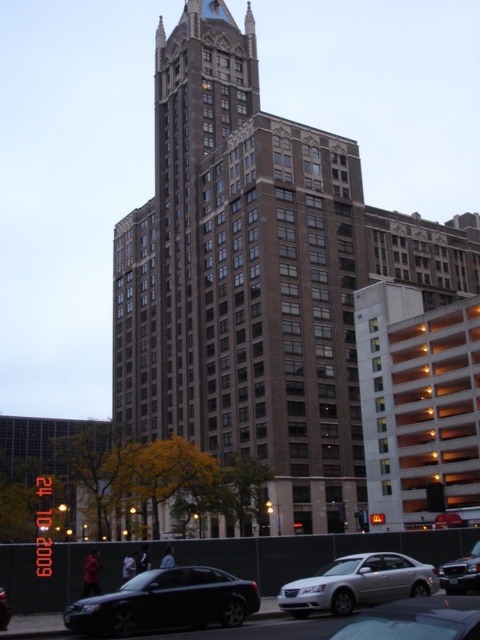
Question: Which point is closer to the camera?

Choices:
 (A) shiny black sedan at lower left
 (B) metallic silver sedan at lower center

Answer: (B)

Question: Can you confirm if shiny black sedan at lower left is positioned to the left of silver metallic sedan at lower center?

Choices:
 (A) no
 (B) yes

Answer: (B)

Question: Can you confirm if silver metallic sedan at lower center is positioned to the right of shiny silver sedan at center?

Choices:
 (A) no
 (B) yes

Answer: (A)

Question: Which of the following is the closest to the observer?

Choices:
 (A) metallic silver sedan at lower center
 (B) silver metallic sedan at lower center

Answer: (A)

Question: Which of these objects is positioned farthest from the shiny silver sedan at center?

Choices:
 (A) brown brick building at center
 (B) shiny black sedan at lower left
 (C) shiny black sedan at center
 (D) silver metallic sedan at lower center

Answer: (A)

Question: Does brown brick building at center appear on the right side of shiny black sedan at lower left?

Choices:
 (A) yes
 (B) no

Answer: (A)